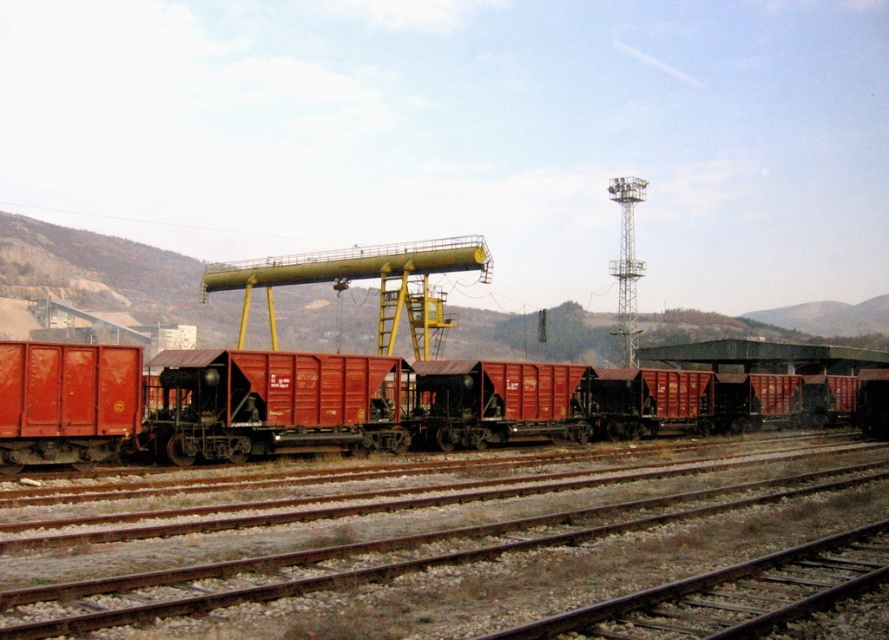
How much distance is there between rusty metal train carriages at center and smooth metal train track at lower right?

A distance of 22.84 meters exists between rusty metal train carriages at center and smooth metal train track at lower right.

Is rusty metal train carriages at center behind smooth metal train track at lower right?

Yes, rusty metal train carriages at center is further from the viewer.

Describe the element at coordinates (197, 403) in the screenshot. The image size is (889, 640). I see `rusty metal train carriages at center` at that location.

I want to click on rusty metal train carriages at center, so click(197, 403).

Who is higher up, smooth metal tracks at center or rusty metal train carriages at center?

rusty metal train carriages at center is above.

Between smooth metal tracks at center and rusty metal train carriages at center, which one has more height?

rusty metal train carriages at center is taller.

What do you see at coordinates (442, 545) in the screenshot? I see `smooth metal tracks at center` at bounding box center [442, 545].

In order to click on smooth metal tracks at center in this screenshot , I will do `click(442, 545)`.

Is smooth metal tracks at center below smooth metal train track at lower right?

Indeed, smooth metal tracks at center is positioned under smooth metal train track at lower right.

Who is more forward, (327,608) or (601,628)?

Point (601,628) is more forward.

Where is `smooth metal tracks at center`? smooth metal tracks at center is located at coordinates (442, 545).